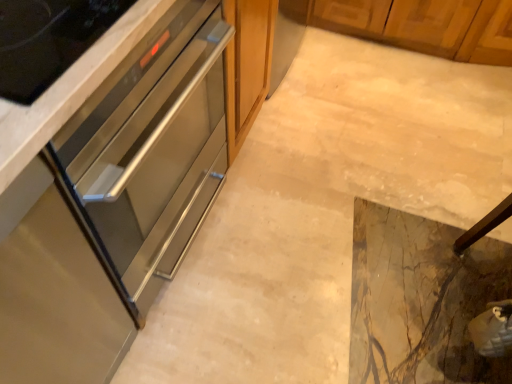
Locate an element on the screen. The image size is (512, 384). vacant space situated above marble tile floor at center (from a real-world perspective) is located at coordinates (339, 184).